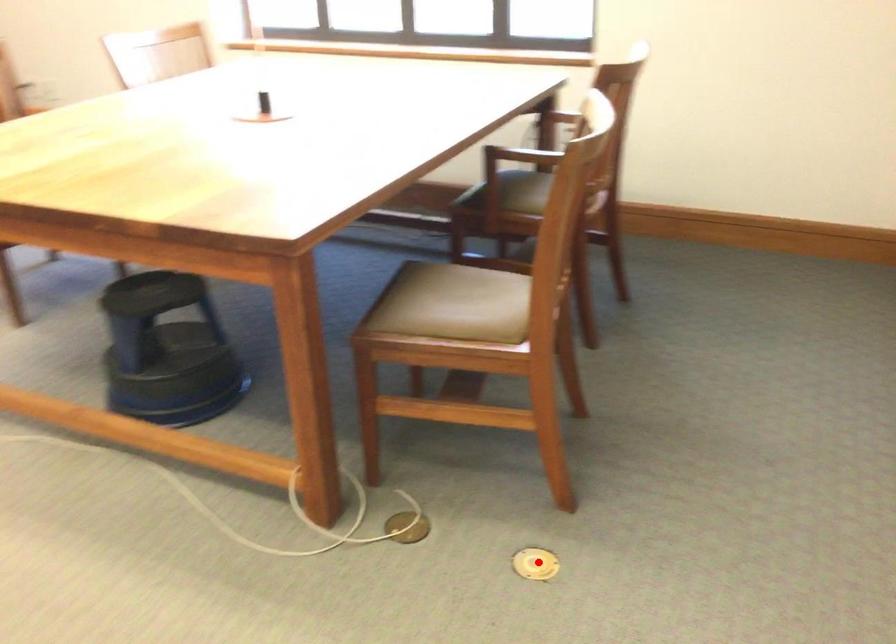
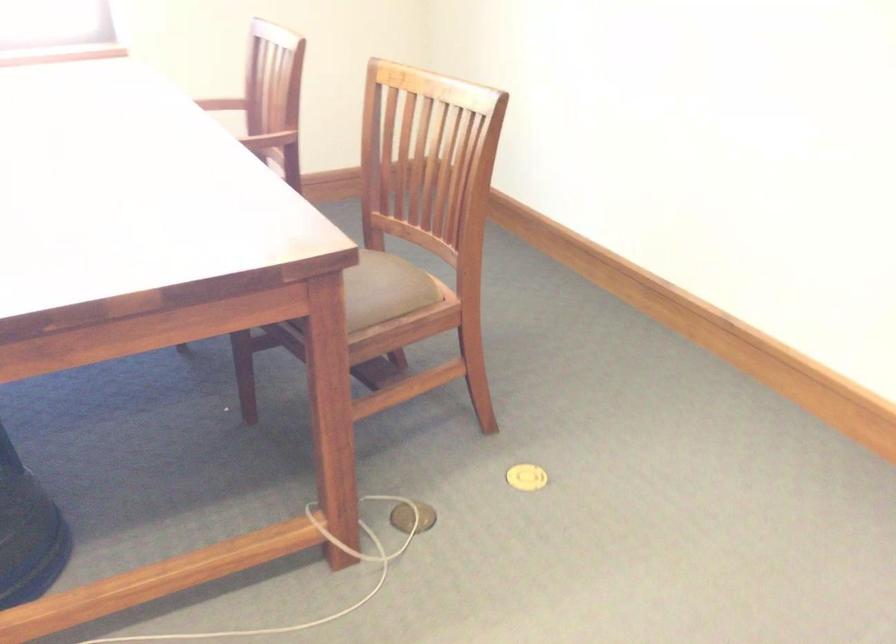
The point at the highlighted location is marked in the first image. Where is the corresponding point in the second image?

(526, 477)